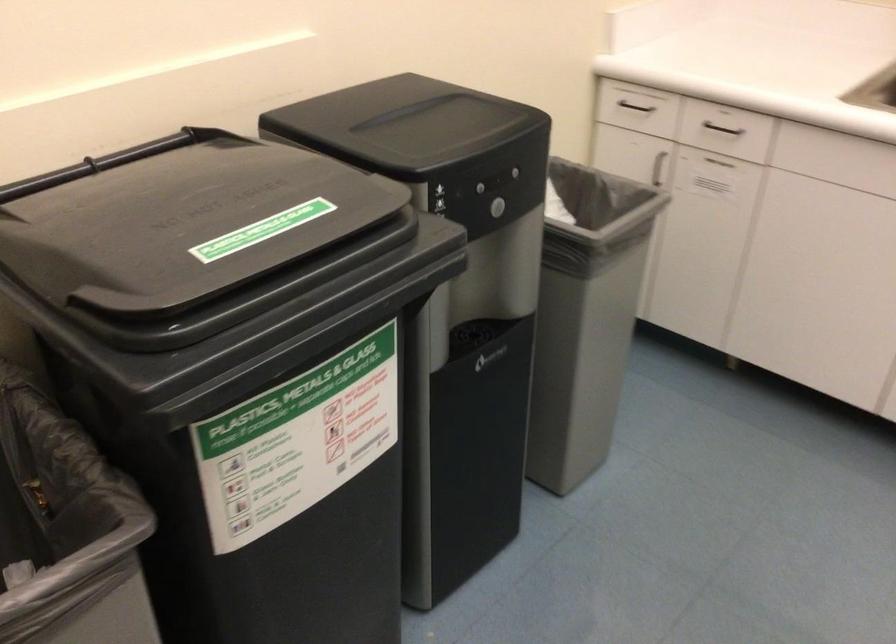
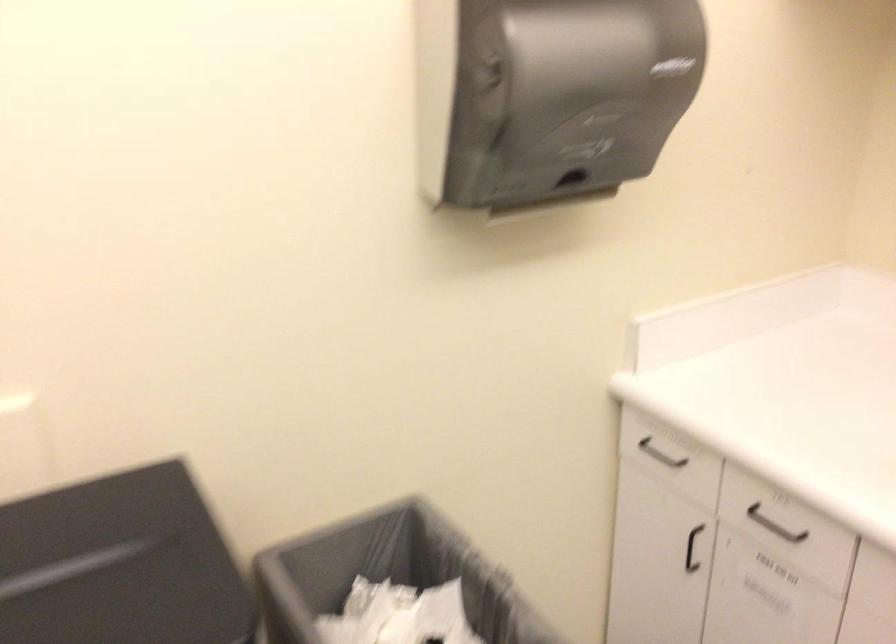
The images are taken continuously from a first-person perspective. In which direction are you moving?

The cameraman walked toward right, forward.